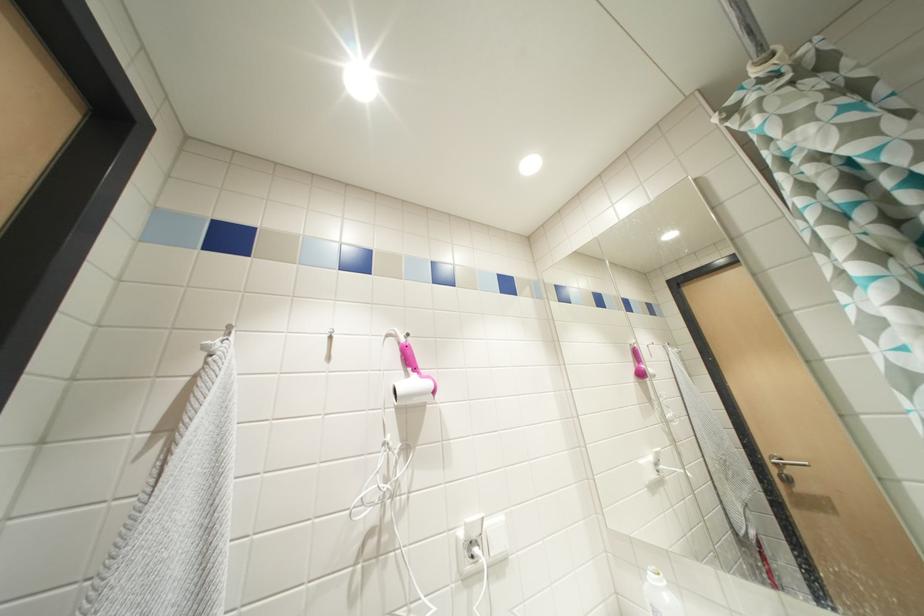
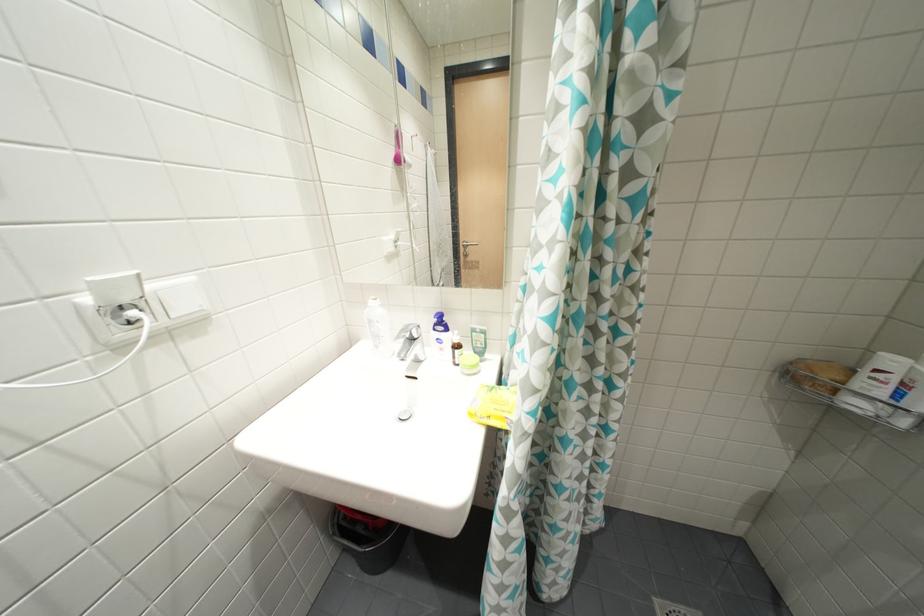
Based on the continuous images, in which direction is the camera rotating?

The camera rotated toward right-down.